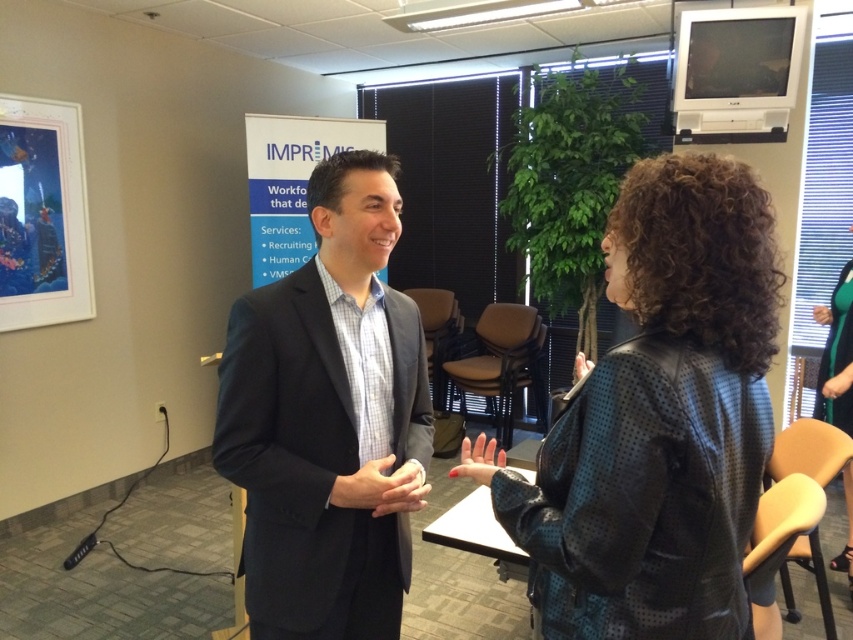
Question: Does black leather jacket at center appear on the left side of blue paper at center?

Choices:
 (A) yes
 (B) no

Answer: (B)

Question: Which point is closer to the camera?

Choices:
 (A) black leather jacket at center
 (B) dark blue suit at center

Answer: (A)

Question: Can you confirm if dark blue suit at center is smaller than blue paper at center?

Choices:
 (A) no
 (B) yes

Answer: (B)

Question: Estimate the real-world distances between objects in this image. Which object is closer to the blue paper at center?

Choices:
 (A) black leather jacket at center
 (B) dark blue suit at center

Answer: (B)

Question: Where is black leather jacket at center located in relation to dark blue suit at center in the image?

Choices:
 (A) above
 (B) below

Answer: (B)

Question: Estimate the real-world distances between objects in this image. Which object is closer to the dark blue suit at center?

Choices:
 (A) blue paper at center
 (B) black leather jacket at center

Answer: (B)